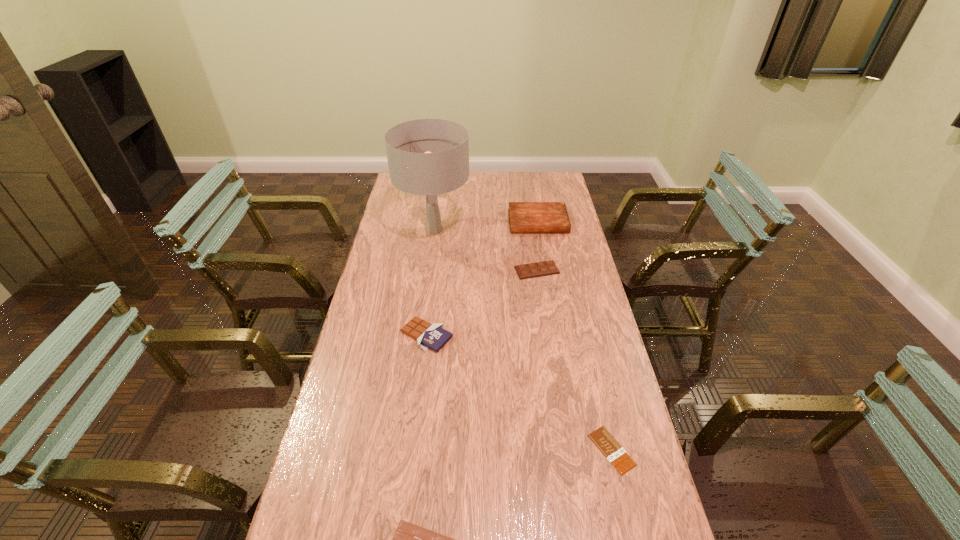
Image resolution: width=960 pixels, height=540 pixels. I want to click on vacant space that is in between the second tallest object and the lampshade, so (486, 226).

Image resolution: width=960 pixels, height=540 pixels. I want to click on free space that is in between the fourth shortest object and the tallest object, so click(x=430, y=282).

This screenshot has height=540, width=960. Identify the location of unoccupied area between the tallest object and the fifth farthest object. (523, 340).

At what (x,y) coordinates should I click in order to perform the action: click on free space between the fourth nearest object and the Bible. Please return your answer as a coordinate pair (x, y). Looking at the image, I should click on (538, 246).

Locate an element on the screen. empty location between the second nearest object and the third nearest chocolate bar is located at coordinates (519, 393).

This screenshot has height=540, width=960. I want to click on the second closest object to the fifth shortest object, so click(545, 268).

Locate which object ranks third in proximity to the fifth shortest object. Please provide its 2D coordinates. Your answer should be formatted as a tuple, i.e. [(x, y)], where the tuple contains the x and y coordinates of a point satisfying the conditions above.

[(433, 336)]

You are a GUI agent. You are given a task and a screenshot of the screen. Output one action in this format:
    pyautogui.click(x=<x>, y=<y>)
    Task: Click on the chocolate bar identified as the third closest to the second tallest chocolate bar
    This screenshot has width=960, height=540.
    Given the screenshot: What is the action you would take?
    [409, 539]

Find the location of a particular element. chocolate bar that stands as the closest to the farthest chocolate bar is located at coordinates (433, 336).

This screenshot has height=540, width=960. Find the location of `vacant space that satisfies the following two spatial constraints: 1. on the front-facing side of the lampshade; 2. on the left side of the shortest chocolate bar`. vacant space that satisfies the following two spatial constraints: 1. on the front-facing side of the lampshade; 2. on the left side of the shortest chocolate bar is located at coordinates pyautogui.click(x=404, y=450).